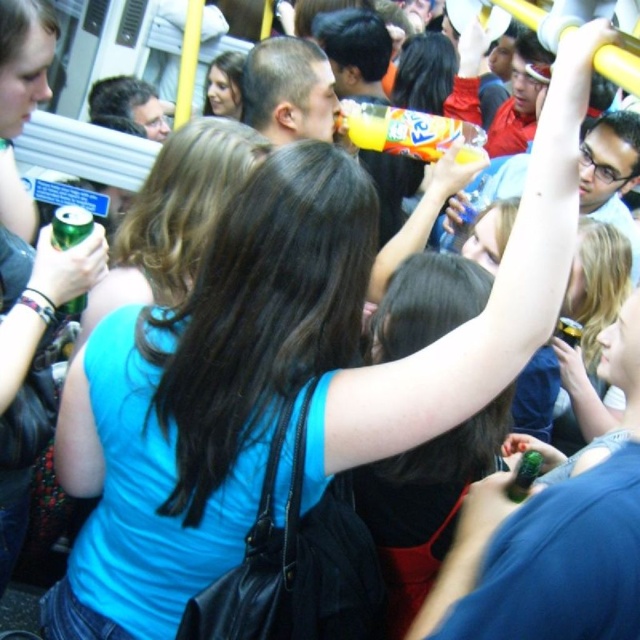
Question: Which of the following is the farthest from the observer?

Choices:
 (A) (524, 468)
 (B) (166, 305)
 (C) (227, 83)

Answer: (C)

Question: Which point is farther from the camera taking this photo?

Choices:
 (A) (182, 248)
 (B) (570, 332)

Answer: (B)

Question: Can you confirm if blue fabric shirt at center is thinner than translucent orange bottle at upper center?

Choices:
 (A) no
 (B) yes

Answer: (B)

Question: Is blue fabric shirt at center positioned at the back of green matte can at upper left?

Choices:
 (A) yes
 (B) no

Answer: (A)

Question: Is smooth brown hair at upper center thinner than metallic silver can at upper right?

Choices:
 (A) yes
 (B) no

Answer: (B)

Question: Which object appears closest to the camera in this image?

Choices:
 (A) green matte bottle at upper right
 (B) translucent orange bottle at upper center
 (C) green matte can at upper left
 (D) smooth brown hair at upper center

Answer: (A)